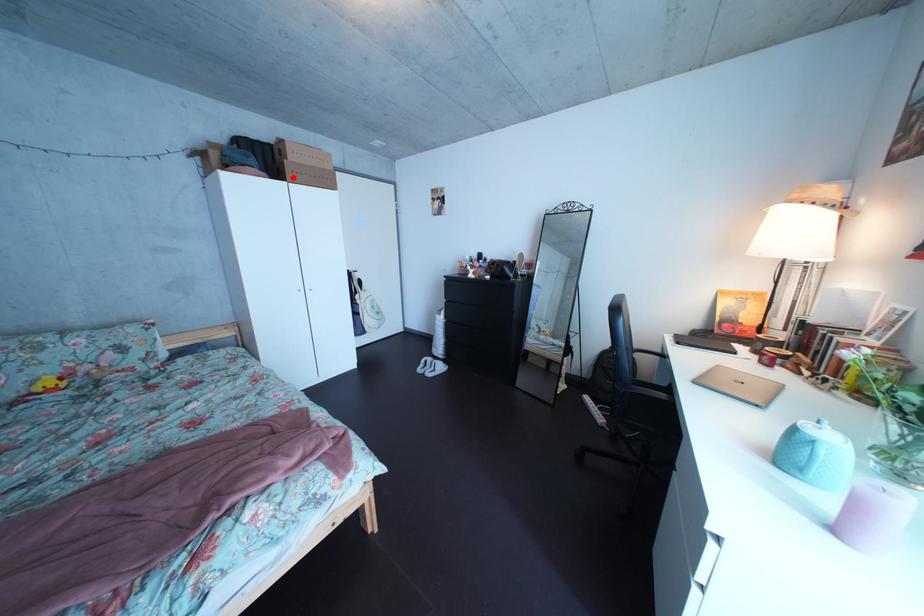
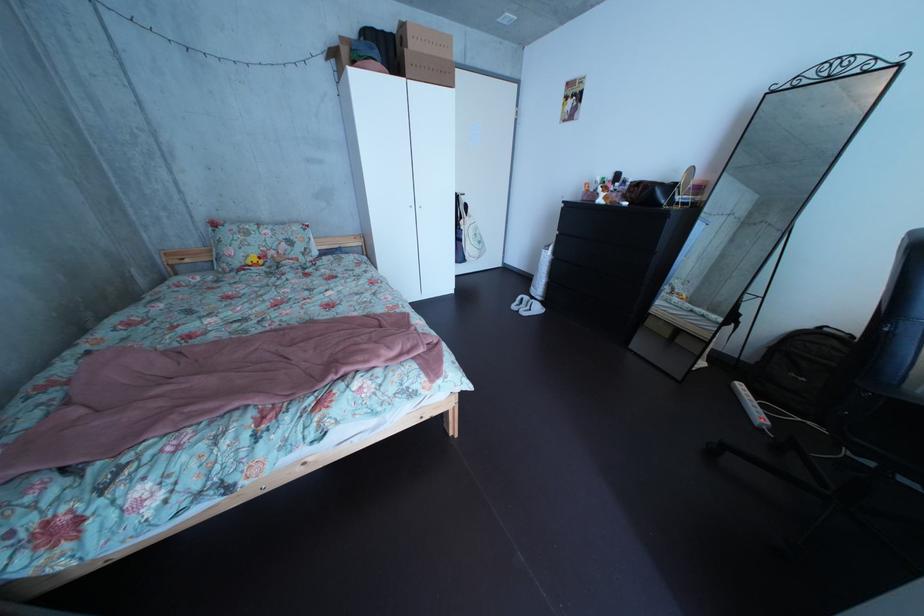
In the second image, find the point that corresponds to the highlighted location in the first image.

(414, 73)